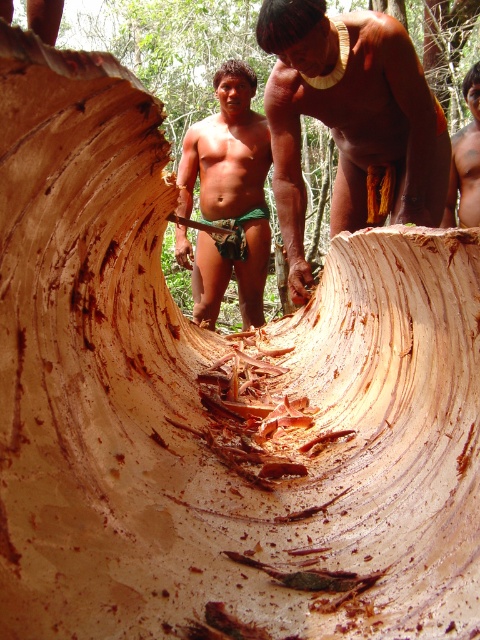
You are a carpenter assessing the tree trunk. Which part of the tree trunk would you consider more suitable for carving intricate designs, the smooth brown wood at center or the brown textured skin at upper center? Explain your choice based on their sizes.

The smooth brown wood at center is bigger than the brown textured skin at upper center, making it more suitable for carving intricate designs as it provides a larger surface area to work with.

You are standing at the point marked as point (363,150) in the forest scene. A friend is standing 3.48 meters away from you. If you want to throw a small stone to your friend, will it reach them?

The distance between you and your friend is exactly 3.48 meters. Since the question doesn not provide any information about obstacles or the throwing ability, we assume it can reach if thrown accurately.

You are a photographer taking a picture of the scene. You notice the matte green shorts at center and the brown textured skin at upper center. Which object is positioned lower in the frame?

The matte green shorts at center is located below brown textured skin at upper center, so the matte green shorts at center is positioned lower in the frame.